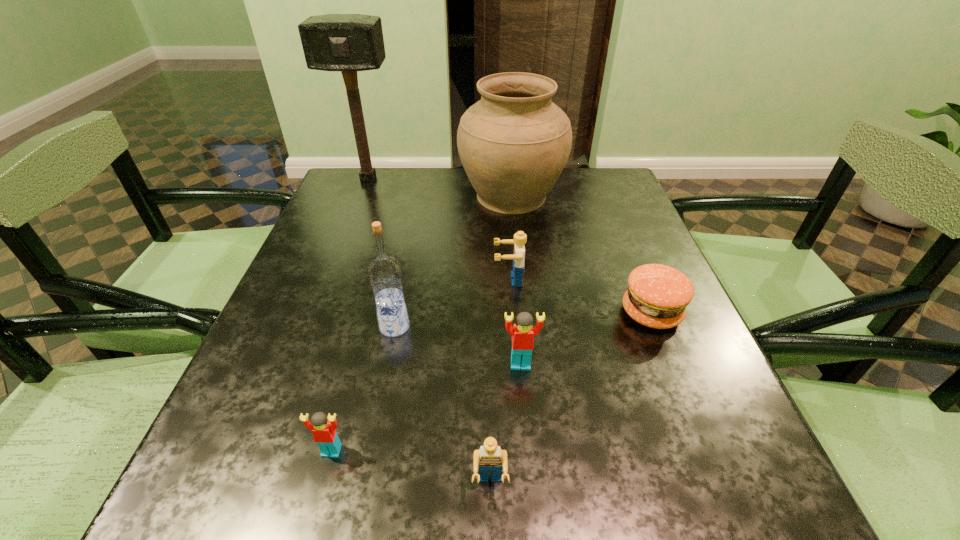
Image resolution: width=960 pixels, height=540 pixels. Find the location of `mallet`. mallet is located at coordinates (348, 43).

Find the location of a particular element. Image resolution: width=960 pixels, height=540 pixels. the seventh shortest object is located at coordinates (514, 143).

I want to click on the sixth shortest object, so click(x=385, y=275).

The height and width of the screenshot is (540, 960). I want to click on blue vodka, so click(385, 275).

This screenshot has height=540, width=960. Identify the location of the farther red Lego. (522, 332).

Locate an element on the screen. the sixth farthest object is located at coordinates (522, 332).

In order to click on the farthest Lego in this screenshot , I will do `click(520, 238)`.

I want to click on the bigger blue Lego, so click(x=520, y=238).

Where is `the rightmost object`? The width and height of the screenshot is (960, 540). the rightmost object is located at coordinates 657,296.

Identify the location of the left red Lego. (323, 428).